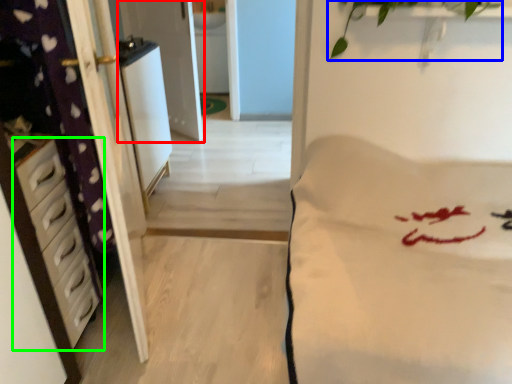
Question: Estimate the real-world distances between objects in this image. Which object is farther from screen door (highlighted by a red box), plant (highlighted by a blue box) or chest of drawers (highlighted by a green box)?

Choices:
 (A) plant
 (B) chest of drawers

Answer: (B)